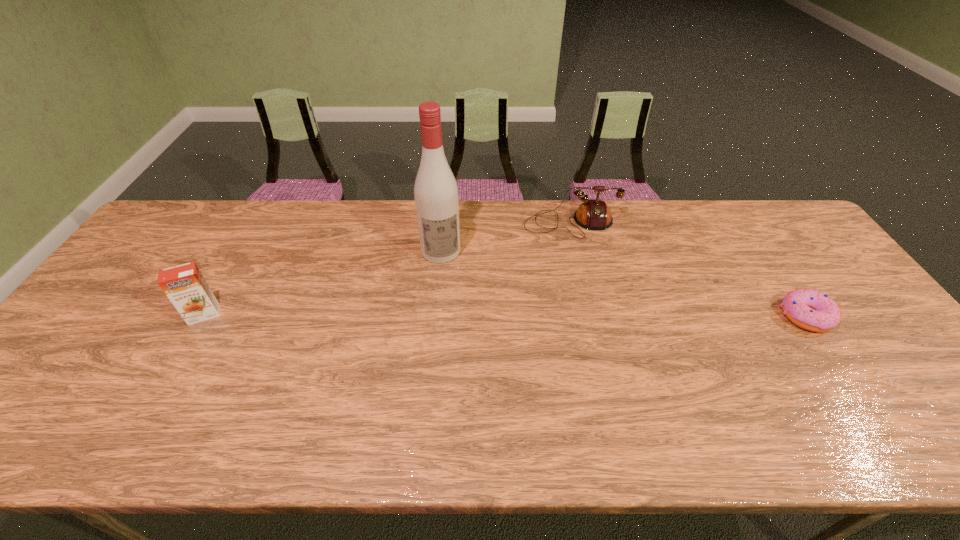
At what (x,y) coordinates should I click in order to perform the action: click on the leftmost object. Please return your answer as a coordinate pair (x, y). The width and height of the screenshot is (960, 540). Looking at the image, I should click on (184, 285).

Find the location of a particular element. This screenshot has height=540, width=960. the second tallest object is located at coordinates (184, 285).

You are a GUI agent. You are given a task and a screenshot of the screen. Output one action in this format:
    pyautogui.click(x=<x>, y=<y>)
    Task: Click on the rightmost object
    
    Given the screenshot: What is the action you would take?
    pyautogui.click(x=812, y=310)

What are the coordinates of `the shortest object` in the screenshot? It's located at (812, 310).

Image resolution: width=960 pixels, height=540 pixels. I want to click on alcohol, so click(436, 198).

Locate an element on the screen. the second object from left to right is located at coordinates (436, 198).

Identify the location of telephone. (593, 214).

Find the location of `the third object from left to right`. the third object from left to right is located at coordinates (593, 214).

I want to click on free region located on the right of the second tallest object, so pos(277,314).

I want to click on free region located on the back of the rightmost object, so tap(773, 267).